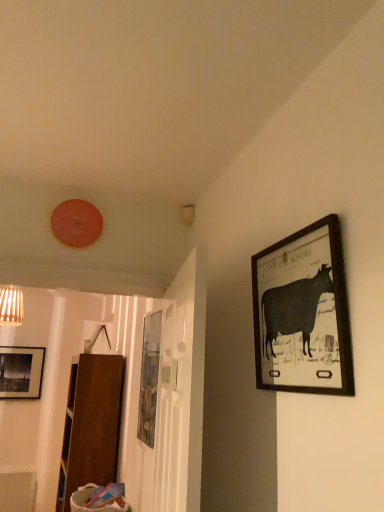
Measure the distance between point (267, 306) and camera.

Point (267, 306) and camera are 4.15 feet apart from each other.

Find the location of a particular element. Image resolution: width=384 pixels, height=512 pixels. matte black picture frame at upper right, the second picture frame from the left is located at coordinates (303, 313).

What is the approximate width of matte black picture frame at upper right, positioned as the 1th picture frame in top-to-bottom order?

The width of matte black picture frame at upper right, positioned as the 1th picture frame in top-to-bottom order, is 2.38 inches.

Describe the element at coordinates (303, 313) in the screenshot. I see `matte black picture frame at upper right, positioned as the 1th picture frame in front-to-back order` at that location.

Image resolution: width=384 pixels, height=512 pixels. Describe the element at coordinates (149, 378) in the screenshot. I see `matte wooden picture frame at center, the first picture frame in the left-to-right sequence` at that location.

In order to face matte wooden picture frame at center, which appears as the first picture frame when ordered from the bottom, should I rotate leftwards or rightwards?

Rotate left and turn 5.576 degrees.

Find the location of a particular element. The height and width of the screenshot is (512, 384). matte wooden picture frame at center, the first picture frame positioned from the back is located at coordinates (149, 378).

Where is `matte black picture frame at upper right, the second picture frame from the left`? The height and width of the screenshot is (512, 384). matte black picture frame at upper right, the second picture frame from the left is located at coordinates (303, 313).

Which object is positioned more to the right, matte black picture frame at upper right, acting as the 1th picture frame starting from the right, or matte wooden picture frame at center, the 2th picture frame viewed from the front?

From the viewer's perspective, matte black picture frame at upper right, acting as the 1th picture frame starting from the right, appears more on the right side.

Which object is more forward, matte black picture frame at upper right, acting as the 1th picture frame starting from the right, or matte wooden picture frame at center, the 2th picture frame from the top?

matte black picture frame at upper right, acting as the 1th picture frame starting from the right, is in front.

Which is in front, point (276, 286) or point (149, 441)?

The point (276, 286) is more forward.

From the image's perspective, which one is positioned higher, matte black picture frame at upper right, the second picture frame from the left, or matte wooden picture frame at center, the first picture frame in the left-to-right sequence?

matte black picture frame at upper right, the second picture frame from the left, appears higher in the image.

Consider the image. From a real-world perspective, who is located higher, matte black picture frame at upper right, positioned as the 1th picture frame in top-to-bottom order, or matte wooden picture frame at center, the 2th picture frame viewed from the front?

matte black picture frame at upper right, positioned as the 1th picture frame in top-to-bottom order.

Consider the image. Which of these two, matte black picture frame at upper right, acting as the 1th picture frame starting from the right, or matte wooden picture frame at center, the 2th picture frame from the top, is wider?

Wider between the two is matte wooden picture frame at center, the 2th picture frame from the top.

Considering the sizes of objects matte black picture frame at upper right, acting as the 1th picture frame starting from the right, and matte wooden picture frame at center, which is the 2th picture frame from right to left, in the image provided, who is taller, matte black picture frame at upper right, acting as the 1th picture frame starting from the right, or matte wooden picture frame at center, which is the 2th picture frame from right to left,?

Standing taller between the two is matte wooden picture frame at center, which is the 2th picture frame from right to left.

Can you confirm if matte black picture frame at upper right, arranged as the 2th picture frame when ordered from the bottom, is bigger than matte wooden picture frame at center, the 2th picture frame from the top?

No, matte black picture frame at upper right, arranged as the 2th picture frame when ordered from the bottom, is not bigger than matte wooden picture frame at center, the 2th picture frame from the top.

Is matte black picture frame at upper right, positioned as the 1th picture frame in front-to-back order, not within matte wooden picture frame at center, the first picture frame in the left-to-right sequence?

matte black picture frame at upper right, positioned as the 1th picture frame in front-to-back order, is positioned outside matte wooden picture frame at center, the first picture frame in the left-to-right sequence.

Is matte black picture frame at upper right, arranged as the 2th picture frame when ordered from the bottom, far from matte wooden picture frame at center, the 2th picture frame from the top?

matte black picture frame at upper right, arranged as the 2th picture frame when ordered from the bottom, is far away from matte wooden picture frame at center, the 2th picture frame from the top.

Does matte black picture frame at upper right, the second picture frame from the left, turn towards matte wooden picture frame at center, which is the 2th picture frame from right to left?

No, matte black picture frame at upper right, the second picture frame from the left, does not turn towards matte wooden picture frame at center, which is the 2th picture frame from right to left.

How different are the orientations of matte black picture frame at upper right, the second picture frame from the left, and matte wooden picture frame at center, the 2th picture frame viewed from the front, in degrees?

0.0384 degrees separate the facing orientations of matte black picture frame at upper right, the second picture frame from the left, and matte wooden picture frame at center, the 2th picture frame viewed from the front.

Identify the location of picture frame behind the matte black picture frame at upper right, positioned as the 1th picture frame in front-to-back order. The height and width of the screenshot is (512, 384). (149, 378).

Is matte wooden picture frame at center, which is the 2th picture frame from right to left, to the right of matte black picture frame at upper right, marked as the second picture frame in a back-to-front arrangement, from the viewer's perspective?

No.

Which is in front, matte wooden picture frame at center, the 2th picture frame viewed from the front, or matte black picture frame at upper right, arranged as the 2th picture frame when ordered from the bottom?

matte black picture frame at upper right, arranged as the 2th picture frame when ordered from the bottom, is in front.

Considering the positions of point (147, 380) and point (319, 386), is point (147, 380) closer or farther from the camera than point (319, 386)?

Clearly, point (147, 380) is more distant from the camera than point (319, 386).

From the image's perspective, between matte wooden picture frame at center, which is the 2th picture frame from right to left, and matte black picture frame at upper right, acting as the 1th picture frame starting from the right, which one is located above?

From the image's view, matte black picture frame at upper right, acting as the 1th picture frame starting from the right, is above.

From a real-world perspective, which is physically below, matte wooden picture frame at center, the 2th picture frame from the top, or matte black picture frame at upper right, arranged as the 2th picture frame when ordered from the bottom?

matte wooden picture frame at center, the 2th picture frame from the top, is physically lower.

Can you confirm if matte wooden picture frame at center, the first picture frame in the left-to-right sequence, is wider than matte black picture frame at upper right, arranged as the 2th picture frame when ordered from the bottom?

Indeed, matte wooden picture frame at center, the first picture frame in the left-to-right sequence, has a greater width compared to matte black picture frame at upper right, arranged as the 2th picture frame when ordered from the bottom.

Can you confirm if matte wooden picture frame at center, the 2th picture frame from the top, is shorter than matte black picture frame at upper right, acting as the 1th picture frame starting from the right?

Incorrect, the height of matte wooden picture frame at center, the 2th picture frame from the top, does not fall short of that of matte black picture frame at upper right, acting as the 1th picture frame starting from the right.

Based on their sizes in the image, would you say matte wooden picture frame at center, the first picture frame in the left-to-right sequence, is bigger or smaller than matte black picture frame at upper right, arranged as the 2th picture frame when ordered from the bottom?

Considering their sizes, matte wooden picture frame at center, the first picture frame in the left-to-right sequence, takes up more space than matte black picture frame at upper right, arranged as the 2th picture frame when ordered from the bottom.

Is matte wooden picture frame at center, the first picture frame in the left-to-right sequence, inside the boundaries of matte black picture frame at upper right, the second picture frame from the left, or outside?

matte wooden picture frame at center, the first picture frame in the left-to-right sequence, cannot be found inside matte black picture frame at upper right, the second picture frame from the left.

Is there a large distance between matte wooden picture frame at center, which appears as the first picture frame when ordered from the bottom, and matte black picture frame at upper right, positioned as the 1th picture frame in front-to-back order?

Yes.

Could you tell me if matte wooden picture frame at center, the first picture frame positioned from the back, is facing matte black picture frame at upper right, marked as the second picture frame in a back-to-front arrangement?

No, matte wooden picture frame at center, the first picture frame positioned from the back, is not turned towards matte black picture frame at upper right, marked as the second picture frame in a back-to-front arrangement.

How different are the orientations of matte wooden picture frame at center, the first picture frame in the left-to-right sequence, and matte black picture frame at upper right, arranged as the 2th picture frame when ordered from the bottom, in degrees?

There is a 0.0384-degree angle between the facing directions of matte wooden picture frame at center, the first picture frame in the left-to-right sequence, and matte black picture frame at upper right, arranged as the 2th picture frame when ordered from the bottom.

Measure the distance between matte wooden picture frame at center, the first picture frame positioned from the back, and matte black picture frame at upper right, marked as the second picture frame in a back-to-front arrangement.

matte wooden picture frame at center, the first picture frame positioned from the back, is 4.56 feet from matte black picture frame at upper right, marked as the second picture frame in a back-to-front arrangement.

Locate an element on the screen. picture frame lying on the right of matte wooden picture frame at center, the first picture frame positioned from the back is located at coordinates (303, 313).

Locate an element on the screen. picture frame below the matte black picture frame at upper right, the second picture frame from the left (from a real-world perspective) is located at coordinates 149,378.

Where is `picture frame on the left side of matte black picture frame at upper right, acting as the 1th picture frame starting from the right`? The width and height of the screenshot is (384, 512). picture frame on the left side of matte black picture frame at upper right, acting as the 1th picture frame starting from the right is located at coordinates (149, 378).